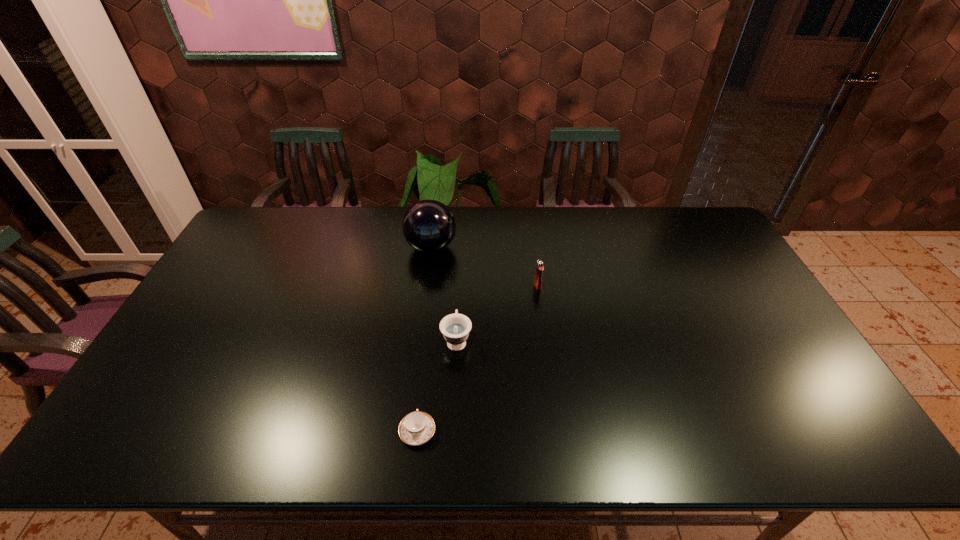
The height and width of the screenshot is (540, 960). Find the location of `the farthest object`. the farthest object is located at coordinates (428, 226).

Image resolution: width=960 pixels, height=540 pixels. I want to click on bowling ball, so click(428, 226).

I want to click on igniter, so coord(540,265).

You are a GUI agent. You are given a task and a screenshot of the screen. Output one action in this format:
    pyautogui.click(x=<x>, y=<y>)
    Task: Click on the second farthest object
    The height and width of the screenshot is (540, 960).
    Given the screenshot: What is the action you would take?
    pyautogui.click(x=540, y=265)

Image resolution: width=960 pixels, height=540 pixels. In order to click on the taller teacup in this screenshot , I will do `click(455, 328)`.

You are a GUI agent. You are given a task and a screenshot of the screen. Output one action in this format:
    pyautogui.click(x=<x>, y=<y>)
    Task: Click on the farther teacup
    Image resolution: width=960 pixels, height=540 pixels.
    Given the screenshot: What is the action you would take?
    pyautogui.click(x=455, y=328)

At what (x,y) coordinates should I click in order to perform the action: click on the shortest object. Please return your answer as a coordinate pair (x, y). The image size is (960, 540). Looking at the image, I should click on (416, 428).

You are a GUI agent. You are given a task and a screenshot of the screen. Output one action in this format:
    pyautogui.click(x=<x>, y=<y>)
    Task: Click on the nearest object
    
    Given the screenshot: What is the action you would take?
    pyautogui.click(x=416, y=428)

Locate an element on the screen. This screenshot has height=540, width=960. vacant area situated on the side of the farthest object with the finger holes is located at coordinates (569, 247).

You are a GUI agent. You are given a task and a screenshot of the screen. Output one action in this format:
    pyautogui.click(x=<x>, y=<y>)
    Task: Click on the vacant space located on the back of the rightmost object
    This screenshot has width=960, height=540.
    Given the screenshot: What is the action you would take?
    pyautogui.click(x=529, y=219)